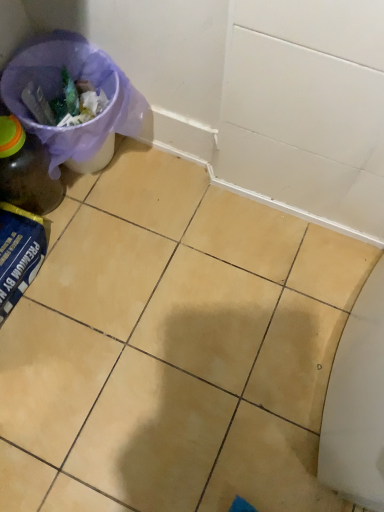
Question: Considering the positions of matte glass bottle at left and purple fabric bag at upper left in the image, is matte glass bottle at left bigger or smaller than purple fabric bag at upper left?

Choices:
 (A) big
 (B) small

Answer: (B)

Question: From their relative heights in the image, would you say matte glass bottle at left is taller or shorter than purple fabric bag at upper left?

Choices:
 (A) tall
 (B) short

Answer: (B)

Question: Which object is the farthest from the yellow matte tile at center?

Choices:
 (A) purple fabric bag at upper left
 (B) matte glass bottle at left

Answer: (B)

Question: Estimate the real-world distances between objects in this image. Which object is closer to the matte glass bottle at left?

Choices:
 (A) yellow matte tile at center
 (B) purple fabric bag at upper left

Answer: (B)